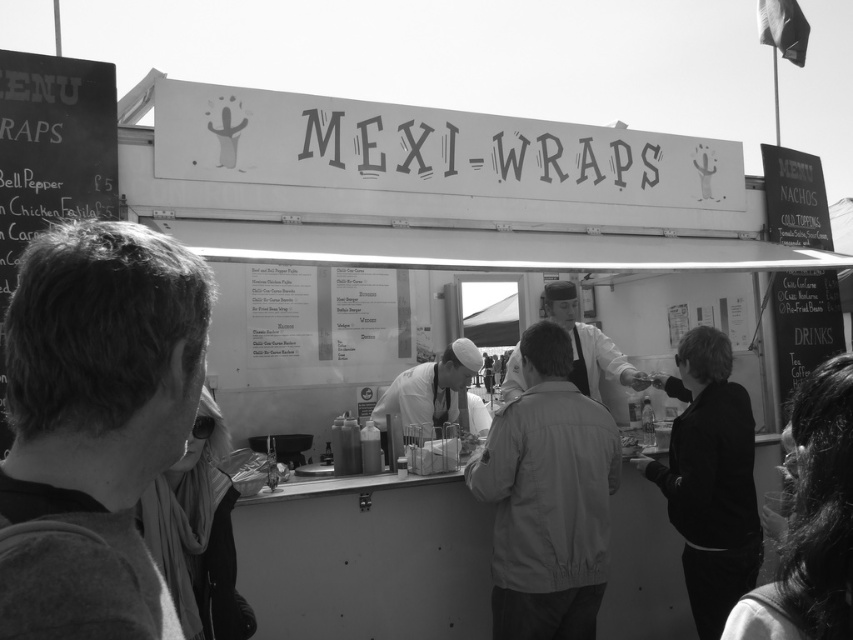
Question: Does light beige jacket at center come in front of dark hair at lower right?

Choices:
 (A) no
 (B) yes

Answer: (A)

Question: Estimate the real-world distances between objects in this image. Which object is closer to the light beige jacket at center?

Choices:
 (A) white matte chef hat at center
 (B) dark hair at lower right
 (C) chalkboard menu at left

Answer: (A)

Question: Estimate the real-world distances between objects in this image. Which object is closer to the dark hair at lower right?

Choices:
 (A) sunglasses at lower left
 (B) light beige jacket at center
 (C) smooth white shirt at center
 (D) smooth black shirt at lower left

Answer: (D)

Question: Can you confirm if smooth black shirt at lower left is positioned to the right of white matte chef hat at center?

Choices:
 (A) no
 (B) yes

Answer: (A)

Question: Does dark hair at lower right appear on the right side of white matte chef hat at center?

Choices:
 (A) yes
 (B) no

Answer: (A)

Question: Which of the following is the closest to the observer?

Choices:
 (A) white matte chef hat at center
 (B) smooth black shirt at lower left
 (C) light beige jacket at center
 (D) black matte jacket at right

Answer: (B)